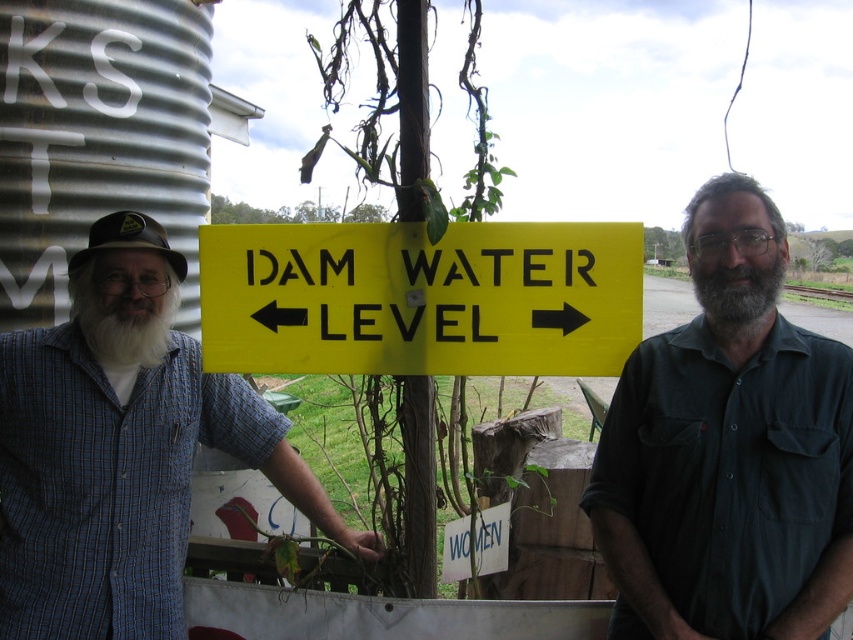
Consider the image. You are a photographer trying to capture both the yellow plastic sign at center and the gray matte beard at center in a single frame. Based on their sizes, which object should you focus on to ensure both fit clearly in the photo?

The yellow plastic sign at center is wider than the gray matte beard at center, so focusing on the yellow plastic sign at center will ensure both objects fit clearly in the photo.